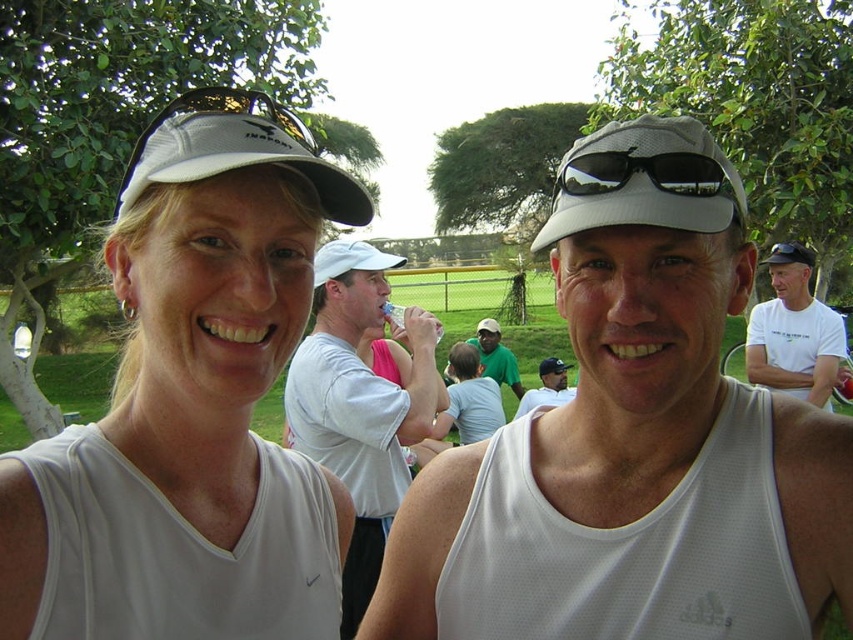
You are standing in the crowd at an outdoor event and notice two items in the image. The first is the white mesh baseball cap at upper left and the second is the white cotton shirt at upper right. Which item is positioned higher in the image?

The white mesh baseball cap at upper left is located above the white cotton shirt at upper right, so it is positioned higher in the image.

You are a photographer taking a picture of the white mesh baseball cap at upper left and the white cotton shirt at upper right. Do you need to adjust your camera focus to ensure both are in focus?

The white mesh baseball cap at upper left is in front of the white cotton shirt at upper right, so if you focus on the white mesh baseball cap at upper left, the white cotton shirt at upper right may be slightly out of focus depending on the depth of field. Adjust the focus accordingly.